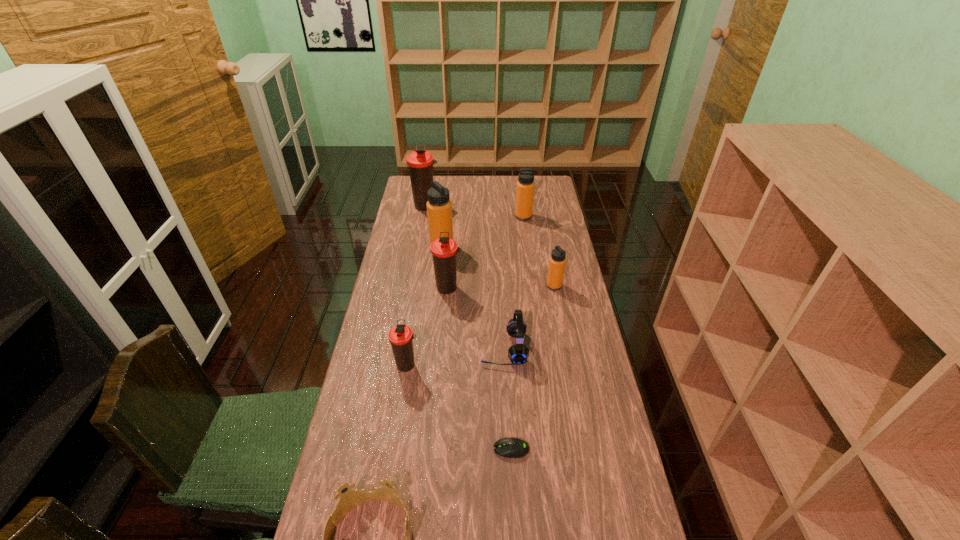
Find the location of `free space at the right edge of the desktop`. free space at the right edge of the desktop is located at coordinates (543, 230).

At what (x,y) coordinates should I click in order to perform the action: click on free space at the far right corner of the desktop. Please return your answer as a coordinate pair (x, y). Looking at the image, I should click on (544, 198).

This screenshot has height=540, width=960. Identify the location of vacant point located between the third shortest object and the leftmost orange thermos bottle. (473, 298).

What are the coordinates of `free point between the second thermos bottle from right to left and the farthest brown thermos bottle` in the screenshot? It's located at (475, 211).

Locate an element on the screen. The height and width of the screenshot is (540, 960). free space between the rightmost thermos bottle and the eighth object from left to right is located at coordinates (539, 251).

In order to click on free space between the computer mouse and the nearest orange thermos bottle in this screenshot , I will do tap(533, 367).

I want to click on vacant space that is in between the second nearest brown thermos bottle and the second orange thermos bottle from left to right, so click(486, 252).

At what (x,y) coordinates should I click in order to perform the action: click on empty space between the second smallest brown thermos bottle and the second smallest orange thermos bottle. Please return your answer as a coordinate pair (x, y). This screenshot has width=960, height=540. Looking at the image, I should click on (486, 252).

Where is `free space between the computer mouse and the smallest brown thermos bottle`? The image size is (960, 540). free space between the computer mouse and the smallest brown thermos bottle is located at coordinates (459, 407).

Identify the location of the seventh closest object to the headset. The height and width of the screenshot is (540, 960). (525, 186).